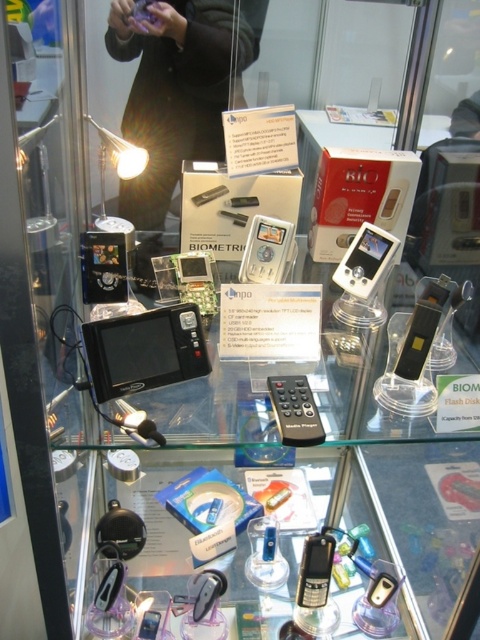
Is black plastic remote at center shorter than clear plastic phone at lower center?

Incorrect, black plastic remote at center's height does not fall short of clear plastic phone at lower center's.

The height and width of the screenshot is (640, 480). What do you see at coordinates (295, 410) in the screenshot?
I see `black plastic remote at center` at bounding box center [295, 410].

Between point (276, 385) and point (144, 620), which one is positioned behind?

The point (144, 620) is more distant.

Where is `black plastic remote at center`? black plastic remote at center is located at coordinates (295, 410).

Can you confirm if metallic black usb flash drive at center is wider than clear plastic phone at lower center?

Indeed, metallic black usb flash drive at center has a greater width compared to clear plastic phone at lower center.

Which is more to the right, metallic black usb flash drive at center or clear plastic phone at lower center?

metallic black usb flash drive at center is more to the right.

Locate an element on the screen. Image resolution: width=480 pixels, height=640 pixels. metallic black usb flash drive at center is located at coordinates (314, 570).

Locate an element on the screen. The width and height of the screenshot is (480, 640). metallic black usb flash drive at center is located at coordinates (314, 570).

The width and height of the screenshot is (480, 640). I want to click on black plastic usb flash drive at center, so click(x=422, y=326).

Can you confirm if black plastic usb flash drive at center is wider than metallic black usb flash drive at center?

Indeed, black plastic usb flash drive at center has a greater width compared to metallic black usb flash drive at center.

Based on the photo, who is more forward, (x=414, y=330) or (x=315, y=566)?

Point (x=414, y=330)

Find the location of a particular element. The image size is (480, 640). black plastic usb flash drive at center is located at coordinates click(x=422, y=326).